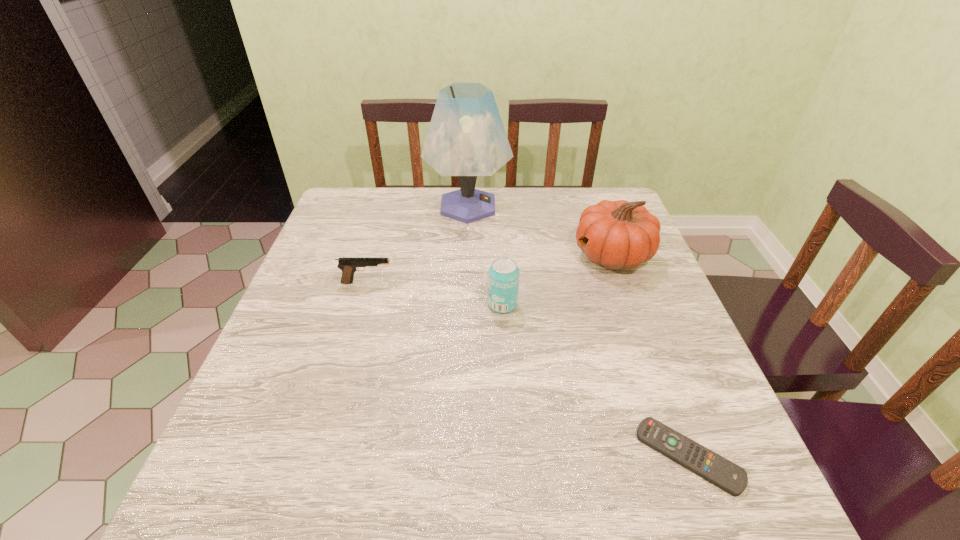
I want to click on remote control positioned at the right edge, so click(x=728, y=476).

Find the location of a particular element. The image size is (960, 540). object that is at the near right corner is located at coordinates (728, 476).

This screenshot has width=960, height=540. What are the coordinates of `vacant space at the far edge` in the screenshot? It's located at tap(565, 200).

What are the coordinates of `free space at the left edge of the desktop` in the screenshot? It's located at (306, 326).

At what (x,y) coordinates should I click in order to perform the action: click on free space at the right edge of the desktop. Please return your answer as a coordinate pair (x, y). Looking at the image, I should click on (662, 341).

Image resolution: width=960 pixels, height=540 pixels. Find the location of `vacant area between the fourth shortest object and the shortest object`. vacant area between the fourth shortest object and the shortest object is located at coordinates (651, 356).

Where is `unoccupied position between the tallest object and the shortest object`? This screenshot has width=960, height=540. unoccupied position between the tallest object and the shortest object is located at coordinates (578, 332).

At what (x,y) coordinates should I click in order to perform the action: click on free spot between the lampshade and the pistol. Please return your answer as a coordinate pair (x, y). This screenshot has height=540, width=960. Looking at the image, I should click on (418, 244).

Find the location of a particular element. empty space that is in between the nearest object and the pumpkin is located at coordinates (651, 356).

The image size is (960, 540). In order to click on unoccupied area between the pistol and the tallest object in this screenshot , I will do `click(418, 244)`.